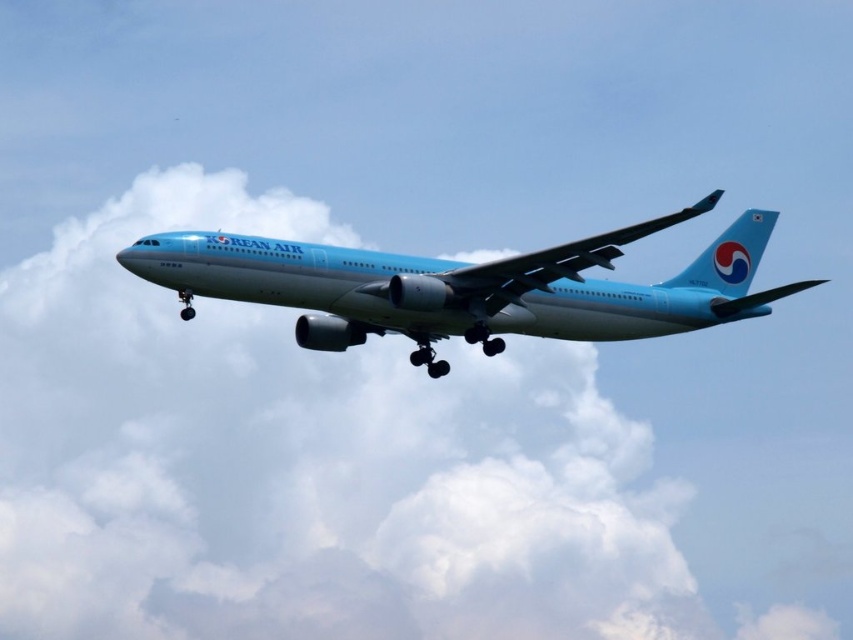
You are a pilot flying a Korean Air aircraft. You notice a point at coordinate (305, 461). What object is located at that point?

The point at coordinate (305, 461) corresponds to the white fluffy cloud at upper center.

You are a pilot observing the sky. You see a white fluffy cloud at upper center and a light blue metallic airplane at center. Which object is located higher in the sky?

The light blue metallic airplane at center is higher because the white fluffy cloud at upper center is positioned under it.